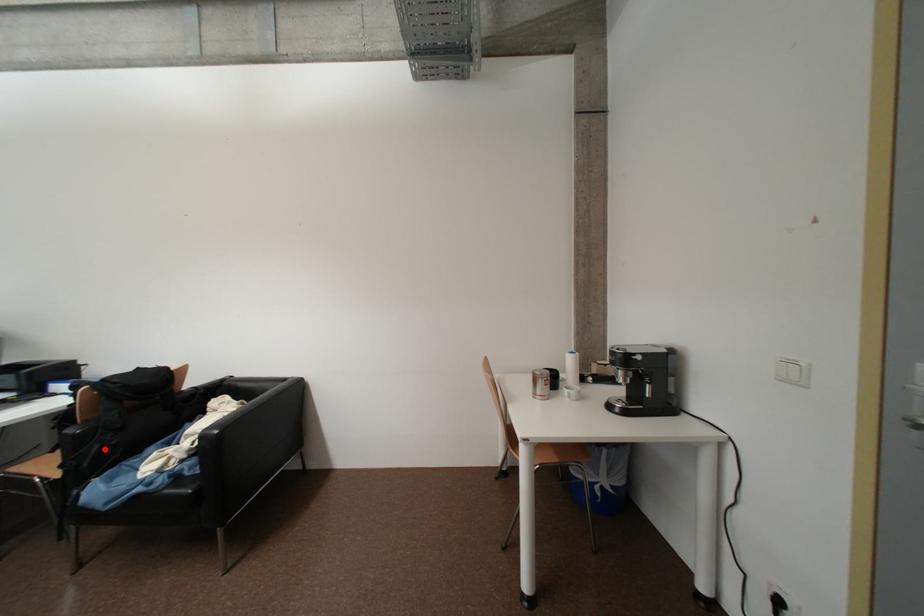
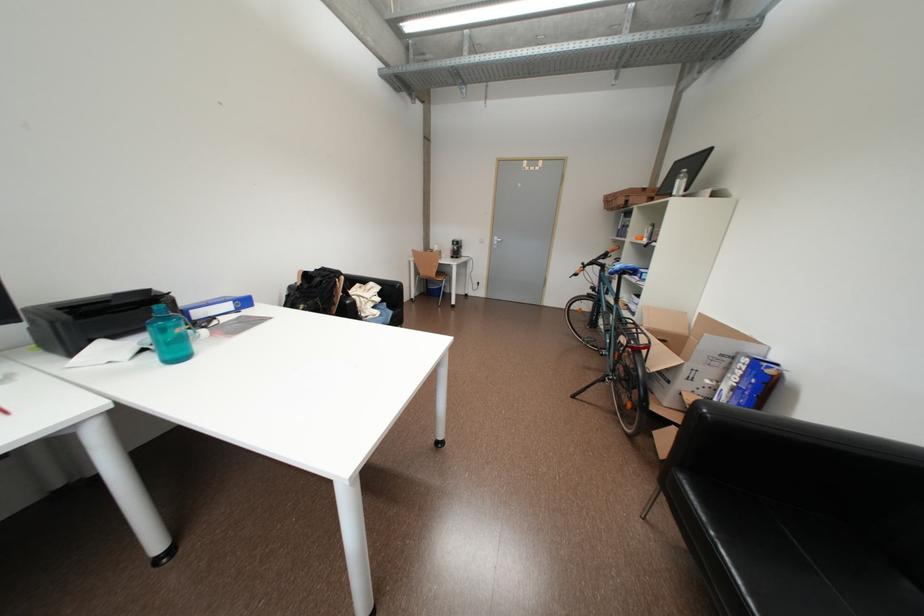
Question: I am providing you with two images of the same scene from different viewpoints. A red point is marked on the first image. At the location where the point appears in image 1, is it still visible in image 2?

Choices:
 (A) Yes
 (B) No

Answer: (B)